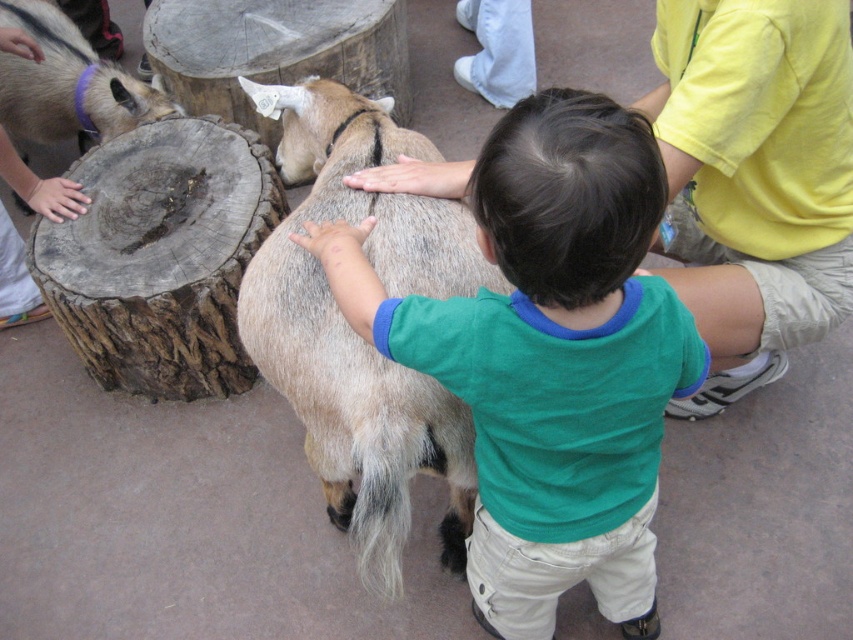
Question: Which object is farther from the camera taking this photo?

Choices:
 (A) green cotton shirt at center
 (B) purple leather collar at upper left

Answer: (B)

Question: Which object is positioned farthest from the green cotton shirt at center?

Choices:
 (A) purple leather collar at upper left
 (B) light brown fur at center

Answer: (A)

Question: Is light brown fur at center smaller than purple leather collar at upper left?

Choices:
 (A) yes
 (B) no

Answer: (B)

Question: Is light brown fur at center further to the viewer compared to purple leather collar at upper left?

Choices:
 (A) no
 (B) yes

Answer: (A)

Question: Can you confirm if green cotton shirt at center is wider than purple leather collar at upper left?

Choices:
 (A) no
 (B) yes

Answer: (B)

Question: Which of the following is the farthest from the observer?

Choices:
 (A) (96, 83)
 (B) (318, 349)
 (C) (438, 333)

Answer: (A)